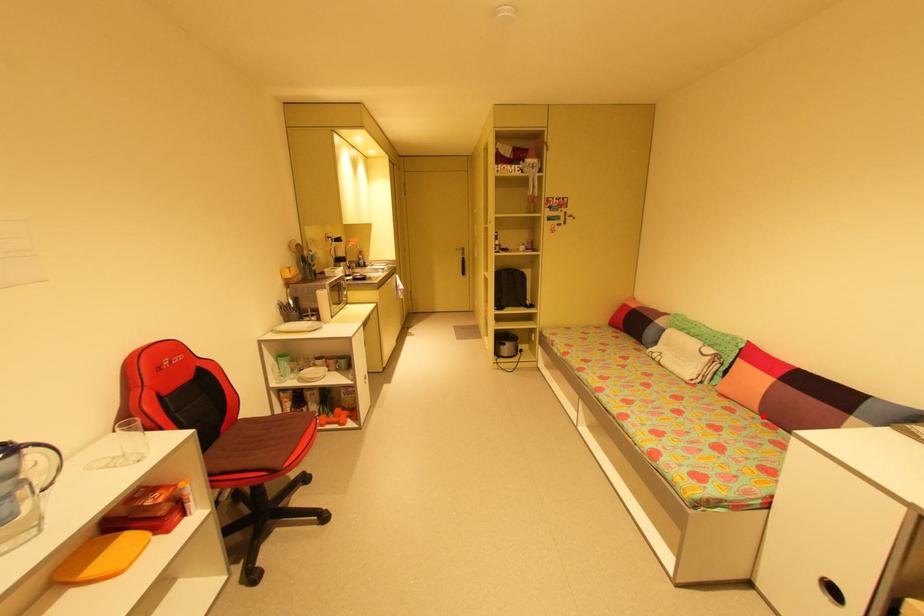
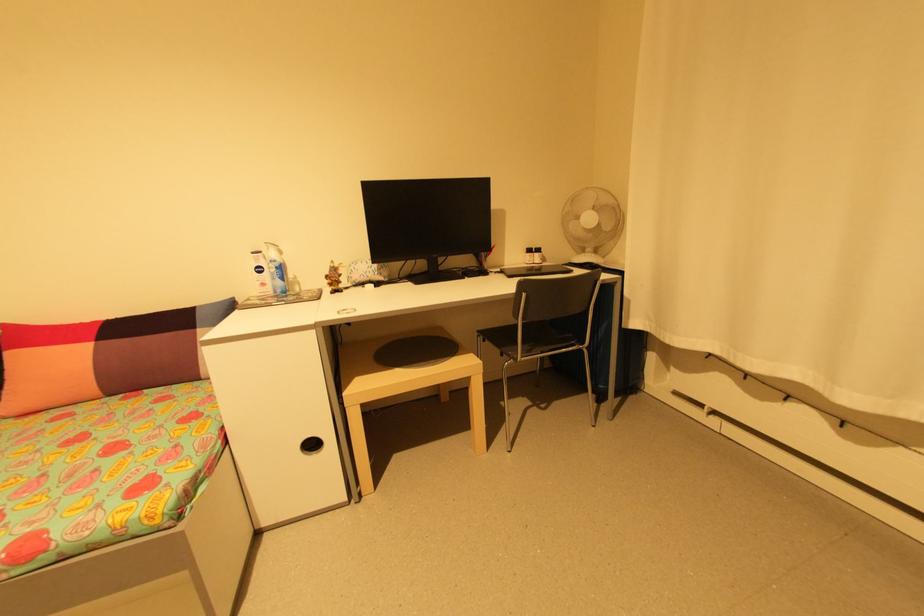
Find the pixel in the second image that matches the highlighted location in the first image.

(111, 399)